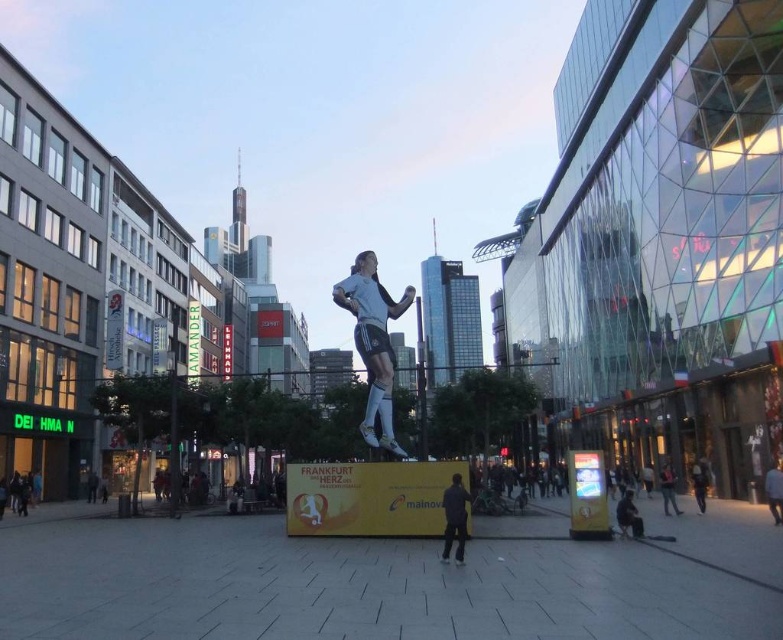
You are an art critic analyzing the sculpture in the urban scene. Based on the description, which object is bigger between the white matte soccer player at center and the white jersey at center?

The white matte soccer player at center is larger than the white jersey at center.